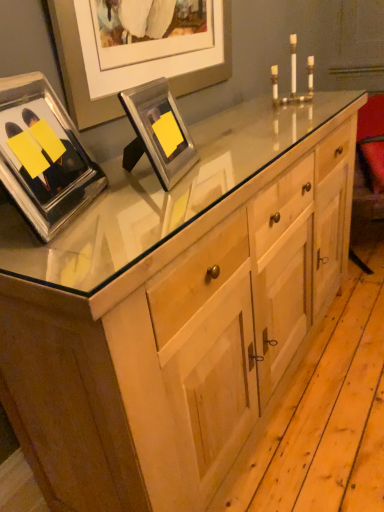
Where is `vacant area located to the right-hand side of gold metallic candle holder at upper center`? vacant area located to the right-hand side of gold metallic candle holder at upper center is located at coordinates (329, 103).